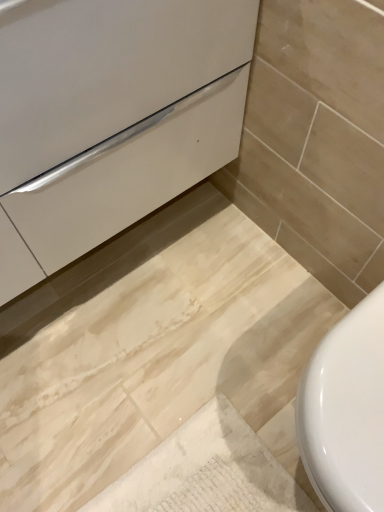
Find the location of a particular element. The height and width of the screenshot is (512, 384). white glossy drawer at center is located at coordinates (131, 175).

In order to face white glossy drawer at center, should I rotate leftwards or rightwards?

To face it directly, rotate left by 18.021 degrees.

What do you see at coordinates (131, 175) in the screenshot? I see `white glossy drawer at center` at bounding box center [131, 175].

Identify the location of white glossy toilet at lower right. (346, 411).

This screenshot has width=384, height=512. What do you see at coordinates (346, 411) in the screenshot?
I see `white glossy toilet at lower right` at bounding box center [346, 411].

Where is `white glossy drawer at center`? The height and width of the screenshot is (512, 384). white glossy drawer at center is located at coordinates (131, 175).

Can you confirm if white glossy toilet at lower right is positioned to the right of white glossy drawer at center?

Yes.

Considering the positions of objects white glossy toilet at lower right and white glossy drawer at center in the image provided, who is behind, white glossy toilet at lower right or white glossy drawer at center?

white glossy toilet at lower right is behind.

Between point (336, 385) and point (29, 191), which one is positioned in front?

Positioned in front is point (336, 385).

From the image's perspective, between white glossy toilet at lower right and white glossy drawer at center, which one is located above?

white glossy drawer at center, from the image's perspective.

From a real-world perspective, between white glossy toilet at lower right and white glossy drawer at center, who is vertically lower?

white glossy toilet at lower right, from a real-world perspective.

Considering the sizes of white glossy toilet at lower right and white glossy drawer at center in the image, is white glossy toilet at lower right wider or thinner than white glossy drawer at center?

Considering their sizes, white glossy toilet at lower right looks slimmer than white glossy drawer at center.

Considering the sizes of white glossy toilet at lower right and white glossy drawer at center in the image, is white glossy toilet at lower right taller or shorter than white glossy drawer at center?

white glossy toilet at lower right is shorter than white glossy drawer at center.

Considering the relative sizes of white glossy toilet at lower right and white glossy drawer at center in the image provided, is white glossy toilet at lower right bigger than white glossy drawer at center?

Incorrect, white glossy toilet at lower right is not larger than white glossy drawer at center.

Is white glossy toilet at lower right completely or partially outside of white glossy drawer at center?

That's correct, white glossy toilet at lower right is outside of white glossy drawer at center.

Are white glossy toilet at lower right and white glossy drawer at center located far from each other?

That's not correct — white glossy toilet at lower right is a little close to white glossy drawer at center.

Is white glossy toilet at lower right positioned with its back to white glossy drawer at center?

white glossy toilet at lower right is not turned away from white glossy drawer at center.

Can you tell me how much white glossy toilet at lower right and white glossy drawer at center differ in facing direction?

88.9 degrees.

There is a white glossy toilet at lower right. Identify the location of drawer above it (from a real-world perspective). The width and height of the screenshot is (384, 512). (131, 175).

Considering the positions of objects white glossy drawer at center and white glossy toilet at lower right in the image provided, who is more to the right, white glossy drawer at center or white glossy toilet at lower right?

From the viewer's perspective, white glossy toilet at lower right appears more on the right side.

Is white glossy drawer at center positioned in front of white glossy toilet at lower right?

Yes, it is.

Which is farther from the camera, [131,159] or [354,385]?

The point [131,159] is more distant.

From the image's perspective, is white glossy drawer at center located above or below white glossy toilet at lower right?

white glossy drawer at center is above white glossy toilet at lower right.

In the scene shown: From a real-world perspective, is white glossy drawer at center located higher than white glossy toilet at lower right?

Yes, from a real-world perspective, white glossy drawer at center is on top of white glossy toilet at lower right.

In terms of width, does white glossy drawer at center look wider or thinner when compared to white glossy toilet at lower right?

white glossy drawer at center is wider than white glossy toilet at lower right.

Which of these two, white glossy drawer at center or white glossy toilet at lower right, stands taller?

With more height is white glossy drawer at center.

Based on their sizes in the image, would you say white glossy drawer at center is bigger or smaller than white glossy toilet at lower right?

Clearly, white glossy drawer at center is larger in size than white glossy toilet at lower right.

Could white glossy toilet at lower right be considered to be inside white glossy drawer at center?

No.

Consider the image. Is white glossy drawer at center not near white glossy toilet at lower right?

They are positioned close to each other.

Does white glossy drawer at center turn towards white glossy toilet at lower right?

Yes, white glossy drawer at center faces towards white glossy toilet at lower right.

How many degrees apart are the facing directions of white glossy drawer at center and white glossy toilet at lower right?

The angular difference between white glossy drawer at center and white glossy toilet at lower right is 88.9 degrees.

How much distance is there between white glossy drawer at center and white glossy toilet at lower right?

22.52 inches.

This screenshot has height=512, width=384. What are the coordinates of `toilet lying below the white glossy drawer at center (from the image's perspective)` in the screenshot? It's located at (346, 411).

Find the location of a particular element. toilet behind the white glossy drawer at center is located at coordinates (346, 411).

Identify the location of drawer on the left of white glossy toilet at lower right. (131, 175).